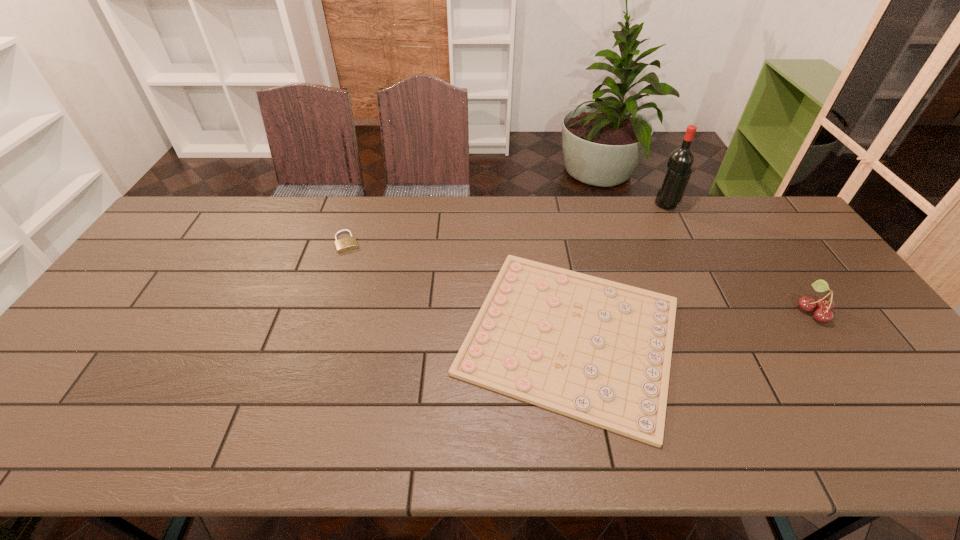
Locate an element on the screen. This screenshot has height=540, width=960. blank space located 0.290m on the leaves of the rightmost object is located at coordinates (691, 311).

You are a GUI agent. You are given a task and a screenshot of the screen. Output one action in this format:
    pyautogui.click(x=<x>, y=<y>)
    Task: Click on the vacant space located on the leaves of the rightmost object
    
    Given the screenshot: What is the action you would take?
    (x=695, y=311)

Where is `vacant space located on the left of the second shortest object`? The image size is (960, 540). vacant space located on the left of the second shortest object is located at coordinates (215, 242).

Identify the location of vacant region located on the back of the gameboard. This screenshot has width=960, height=540. (547, 208).

Locate an element on the screen. This screenshot has width=960, height=540. wine bottle situated at the far edge is located at coordinates (679, 164).

At what (x,y) coordinates should I click in order to perform the action: click on padlock that is at the far edge. Please return your answer as a coordinate pair (x, y). Looking at the image, I should click on (349, 243).

You are a GUI agent. You are given a task and a screenshot of the screen. Output one action in this format:
    pyautogui.click(x=<x>, y=<y>)
    Task: Click on the object positioned at the near edge
    Image resolution: width=960 pixels, height=540 pixels.
    Given the screenshot: What is the action you would take?
    pyautogui.click(x=599, y=351)

Where is `object that is at the right edge`? The width and height of the screenshot is (960, 540). object that is at the right edge is located at coordinates pos(824,305).

In the image, there is a desktop. Where is `vacant space at the far edge`? Image resolution: width=960 pixels, height=540 pixels. vacant space at the far edge is located at coordinates [x=516, y=239].

I want to click on blank space at the near edge of the desktop, so click(372, 424).